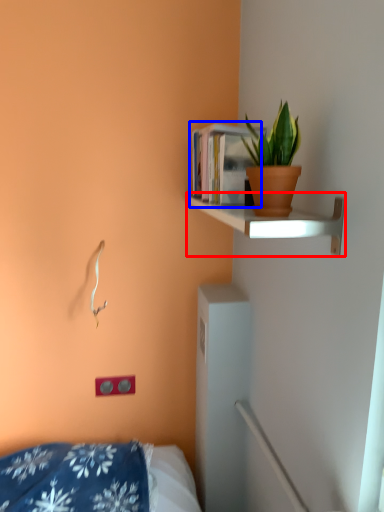
Question: Which point is closer to the camera, shelf (highlighted by a red box) or book (highlighted by a blue box)?

Choices:
 (A) shelf
 (B) book

Answer: (A)